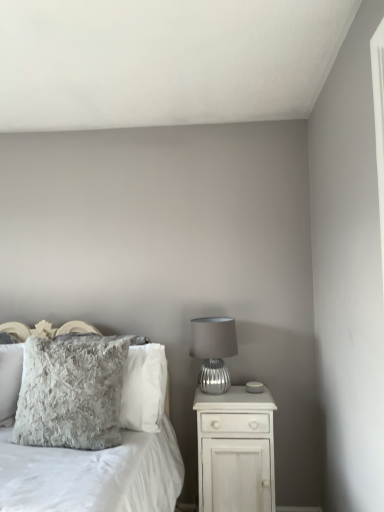
At what (x,y) coordinates should I click in order to perform the action: click on fuzzy gray pillow at center. Please return your answer as a coordinate pair (x, y). Image resolution: width=384 pixels, height=512 pixels. Looking at the image, I should click on (97, 451).

Locate an element on the screen. Image resolution: width=384 pixels, height=512 pixels. silver textured lamp at right is located at coordinates (213, 351).

Describe the element at coordinates (235, 450) in the screenshot. I see `white wood nightstand at right` at that location.

You are a GUI agent. You are given a task and a screenshot of the screen. Output one action in this format:
    pyautogui.click(x=<x>, y=<y>)
    Task: Click on the fuzzy gray pillow at center
    
    Given the screenshot: What is the action you would take?
    pyautogui.click(x=97, y=451)

How distant is silver textured lamp at right from fuzzy gray pillow at center?

silver textured lamp at right is 19.70 inches away from fuzzy gray pillow at center.

From a real-world perspective, between silver textured lamp at right and fuzzy gray pillow at center, who is vertically lower?

fuzzy gray pillow at center.

Does silver textured lamp at right have a lesser width compared to fuzzy gray pillow at center?

Yes.

Which object is more forward, silver textured lamp at right or fuzzy gray pillow at center?

Positioned in front is fuzzy gray pillow at center.

From a real-world perspective, is fuzzy gray pillow at center-left, the first pillow from the back, over fuzzy gray pillow at center?

Indeed, from a real-world perspective, fuzzy gray pillow at center-left, the first pillow from the back, stands above fuzzy gray pillow at center.

In terms of height, does fuzzy gray pillow at center-left, positioned as the 2th pillow in front-to-back order, look taller or shorter compared to fuzzy gray pillow at center?

In the image, fuzzy gray pillow at center-left, positioned as the 2th pillow in front-to-back order, appears to be shorter than fuzzy gray pillow at center.

Is fuzzy gray pillow at center-left, the first pillow from the back, located outside fuzzy gray pillow at center?

That's incorrect, fuzzy gray pillow at center-left, the first pillow from the back, is not completely outside fuzzy gray pillow at center.

Is fuzzy gray pillow at center-left, positioned as the 2th pillow in front-to-back order, far away from fuzzy gray pillow at center?

Actually, fuzzy gray pillow at center-left, positioned as the 2th pillow in front-to-back order, and fuzzy gray pillow at center are a little close together.

Who is more distant, fuzzy gray pillow at left, the 2th pillow positioned from the back, or white wood nightstand at right?

Positioned behind is white wood nightstand at right.

Considering the sizes of objects fuzzy gray pillow at left, which is counted as the 1th pillow, starting from the front, and white wood nightstand at right in the image provided, who is taller, fuzzy gray pillow at left, which is counted as the 1th pillow, starting from the front, or white wood nightstand at right?

white wood nightstand at right.

Does fuzzy gray pillow at left, which is counted as the 1th pillow, starting from the front, have a larger size compared to white wood nightstand at right?

Actually, fuzzy gray pillow at left, which is counted as the 1th pillow, starting from the front, might be smaller than white wood nightstand at right.

Where is `nightstand located on the right of fuzzy gray pillow at left, the 2th pillow positioned from the back`? nightstand located on the right of fuzzy gray pillow at left, the 2th pillow positioned from the back is located at coordinates (235, 450).

Is fuzzy gray pillow at center-left, the first pillow from the back, facing towards silver textured lamp at right?

No, fuzzy gray pillow at center-left, the first pillow from the back, is not facing towards silver textured lamp at right.

Considering the sizes of fuzzy gray pillow at center-left, the first pillow from the back, and silver textured lamp at right in the image, is fuzzy gray pillow at center-left, the first pillow from the back, bigger or smaller than silver textured lamp at right?

Considering their sizes, fuzzy gray pillow at center-left, the first pillow from the back, takes up more space than silver textured lamp at right.

Consider the image. Is fuzzy gray pillow at center-left, the first pillow from the back, surrounding silver textured lamp at right?

Actually, silver textured lamp at right is outside fuzzy gray pillow at center-left, the first pillow from the back.

Does point (198, 381) lie in front of point (205, 462)?

No, it is behind (205, 462).

Locate an element on the screen. This screenshot has height=512, width=384. table lamp located behind the white wood nightstand at right is located at coordinates (213, 351).

Can you confirm if silver textured lamp at right is smaller than white wood nightstand at right?

Correct, silver textured lamp at right occupies less space than white wood nightstand at right.

Who is taller, fuzzy gray pillow at center or fuzzy gray pillow at center-left, the first pillow from the back?

fuzzy gray pillow at center is taller.

The height and width of the screenshot is (512, 384). In order to click on the 2nd pillow counting from the right side of the fuzzy gray pillow at center in this screenshot , I will do [x=145, y=388].

From a real-world perspective, does fuzzy gray pillow at center stand above fuzzy gray pillow at center-left, the first pillow from the back?

No, from a real-world perspective, fuzzy gray pillow at center is not above fuzzy gray pillow at center-left, the first pillow from the back.

Is fuzzy gray pillow at center to the left of fuzzy gray pillow at center-left, the first pillow from the back, from the viewer's perspective?

Yes, fuzzy gray pillow at center is to the left of fuzzy gray pillow at center-left, the first pillow from the back.

Is fuzzy gray pillow at left, which is counted as the 1th pillow, starting from the front, far from silver textured lamp at right?

No, fuzzy gray pillow at left, which is counted as the 1th pillow, starting from the front, is not far away from silver textured lamp at right.

Consider the image. Considering the positions of objects fuzzy gray pillow at left, which is counted as the 1th pillow, starting from the front, and silver textured lamp at right in the image provided, who is in front, fuzzy gray pillow at left, which is counted as the 1th pillow, starting from the front, or silver textured lamp at right?

Positioned in front is fuzzy gray pillow at left, which is counted as the 1th pillow, starting from the front.

Measure the distance between fuzzy gray pillow at left, the 2th pillow positioned from the back, and silver textured lamp at right.

fuzzy gray pillow at left, the 2th pillow positioned from the back, and silver textured lamp at right are 24.58 inches apart.

From the image's perspective, does fuzzy gray pillow at left, the 2th pillow positioned from the back, appear lower than silver textured lamp at right?

Yes, from the image's perspective, fuzzy gray pillow at left, the 2th pillow positioned from the back, is beneath silver textured lamp at right.

I want to click on bed below the silver textured lamp at right (from the image's perspective), so click(x=97, y=451).

I want to click on pillow that is the 1st object located above the fuzzy gray pillow at center (from the image's perspective), so click(x=145, y=388).

Estimate the real-world distances between objects in this image. Which object is further from fuzzy gray pillow at left, which is counted as the 1th pillow, starting from the front, white wood nightstand at right or silver textured lamp at right?

white wood nightstand at right lies further to fuzzy gray pillow at left, which is counted as the 1th pillow, starting from the front, than the other object.

Consider the image. Estimate the real-world distances between objects in this image. Which object is closer to fuzzy gray pillow at center, silver textured lamp at right or fuzzy gray pillow at left, which is counted as the 1th pillow, starting from the front?

fuzzy gray pillow at left, which is counted as the 1th pillow, starting from the front, lies closer to fuzzy gray pillow at center than the other object.

From the image, which object appears to be farther from fuzzy gray pillow at left, the 2th pillow positioned from the back, fuzzy gray pillow at center or fuzzy gray pillow at center-left, the first pillow from the back?

fuzzy gray pillow at center-left, the first pillow from the back, lies further to fuzzy gray pillow at left, the 2th pillow positioned from the back, than the other object.

Estimate the real-world distances between objects in this image. Which object is further from fuzzy gray pillow at center-left, the first pillow from the back, silver textured lamp at right or white wood nightstand at right?

Based on the image, white wood nightstand at right appears to be further to fuzzy gray pillow at center-left, the first pillow from the back.

Considering their positions, is silver textured lamp at right positioned further to fuzzy gray pillow at center-left, the first pillow from the back, than fuzzy gray pillow at center?

A: silver textured lamp at right is positioned further to the anchor fuzzy gray pillow at center-left, the first pillow from the back.

When comparing their distances from fuzzy gray pillow at center-left, positioned as the 2th pillow in front-to-back order, does white wood nightstand at right or fuzzy gray pillow at left, the 2th pillow positioned from the back, seem further?

white wood nightstand at right.

Consider the image. Estimate the real-world distances between objects in this image. Which object is closer to fuzzy gray pillow at left, which is counted as the 1th pillow, starting from the front, fuzzy gray pillow at center or white wood nightstand at right?

Based on the image, fuzzy gray pillow at center appears to be nearer to fuzzy gray pillow at left, which is counted as the 1th pillow, starting from the front.

When comparing their distances from fuzzy gray pillow at center, does fuzzy gray pillow at center-left, positioned as the 2th pillow in front-to-back order, or fuzzy gray pillow at left, which is counted as the 1th pillow, starting from the front, seem closer?

fuzzy gray pillow at center-left, positioned as the 2th pillow in front-to-back order.

You are a GUI agent. You are given a task and a screenshot of the screen. Output one action in this format:
    pyautogui.click(x=<x>, y=<y>)
    Task: Click on the pillow between fuzzy gray pillow at center and fuzzy gray pillow at center-left, positioned as the 2th pillow in front-to-back order, from front to back
    This screenshot has height=512, width=384.
    Given the screenshot: What is the action you would take?
    point(72,392)

What are the coordinates of `table lamp between fuzzy gray pillow at left, the 2th pillow positioned from the back, and white wood nightstand at right` in the screenshot? It's located at (213, 351).

Find the location of a particular element. The height and width of the screenshot is (512, 384). pillow between fuzzy gray pillow at left, which is counted as the 1th pillow, starting from the front, and silver textured lamp at right, in the horizontal direction is located at coordinates (145, 388).

The height and width of the screenshot is (512, 384). Identify the location of pillow between fuzzy gray pillow at left, the 2th pillow positioned from the back, and white wood nightstand at right, in the horizontal direction. (145, 388).